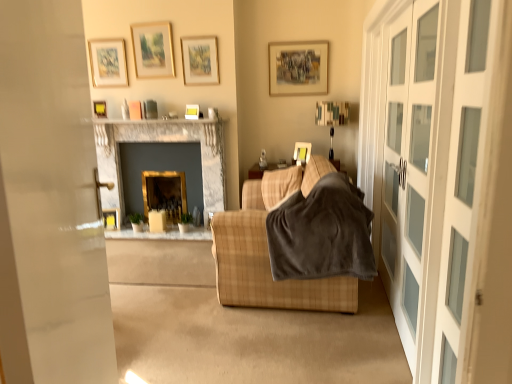
This screenshot has height=384, width=512. In order to click on free space to the left of plaid fabric couch at center in this screenshot , I will do pyautogui.click(x=165, y=273).